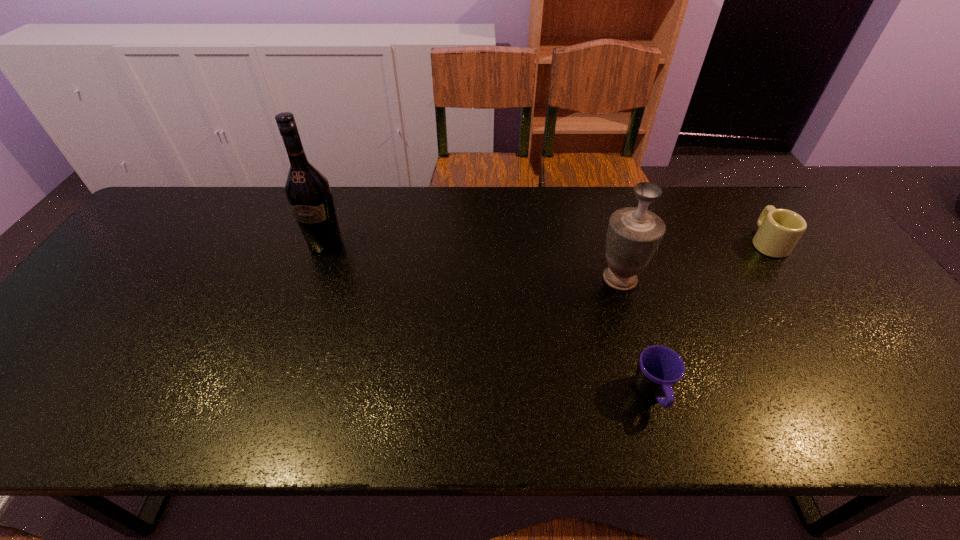
The image size is (960, 540). In order to click on vacant space that is in between the farther mug and the urn in this screenshot , I will do `click(693, 260)`.

Identify which object is the second nearest to the farther mug. Please provide its 2D coordinates. Your answer should be formatted as a tuple, i.e. [(x, y)], where the tuple contains the x and y coordinates of a point satisfying the conditions above.

[(660, 368)]

Locate an element on the screen. This screenshot has width=960, height=540. object that can be found as the third closest to the rightmost object is located at coordinates (308, 192).

Find the location of a particular element. free space that satisfies the following two spatial constraints: 1. on the label of the third farthest object; 2. on the left side of the wine bottle is located at coordinates (312, 279).